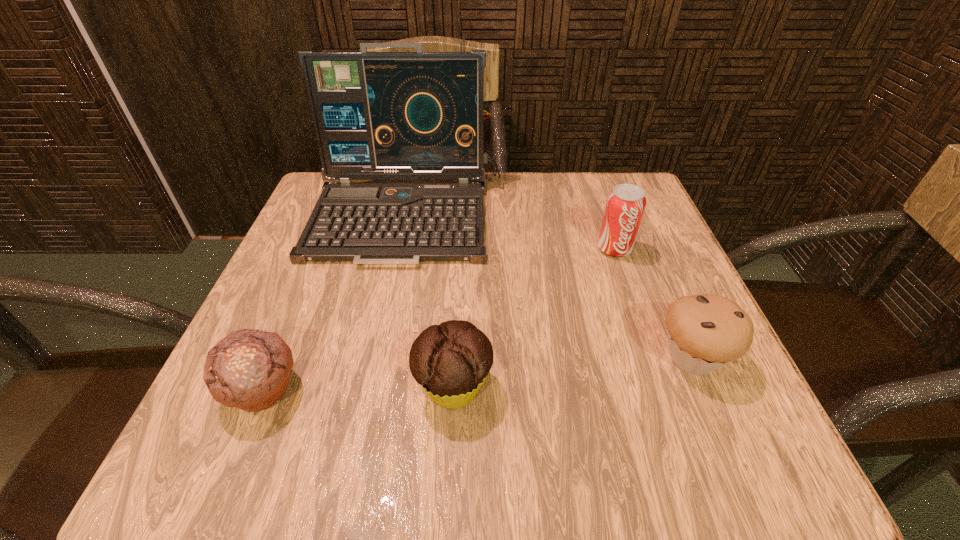
You are a GUI agent. You are given a task and a screenshot of the screen. Output one action in this format:
    pyautogui.click(x=<x>, y=<y>)
    Task: Click on the laptop computer
    The image size is (960, 540).
    Given the screenshot: What is the action you would take?
    pyautogui.click(x=418, y=115)

Where is `the second tallest object`? The width and height of the screenshot is (960, 540). the second tallest object is located at coordinates (625, 205).

Where is `the rightmost muffin`? The image size is (960, 540). the rightmost muffin is located at coordinates (705, 332).

The image size is (960, 540). Identify the location of the second muffin from left to right. (451, 361).

You are a GUI agent. You are given a task and a screenshot of the screen. Output one action in this format:
    pyautogui.click(x=<x>, y=<y>)
    Task: Click on the leftmost muffin
    Image resolution: width=960 pixels, height=540 pixels.
    Given the screenshot: What is the action you would take?
    pyautogui.click(x=249, y=369)

Locate an element on the screen. The height and width of the screenshot is (540, 960). free spot located on the front-facing side of the tallest object is located at coordinates (392, 292).

I want to click on free spot located on the logo side of the soda can, so click(653, 358).

I want to click on free spot located on the back of the rightmost muffin, so click(639, 235).

Find the location of a particular element. This screenshot has height=540, width=960. blank space located on the back of the second muffin from right to left is located at coordinates (460, 258).

Where is `vacant space situated on the back of the leftmost muffin`? Image resolution: width=960 pixels, height=540 pixels. vacant space situated on the back of the leftmost muffin is located at coordinates (338, 210).